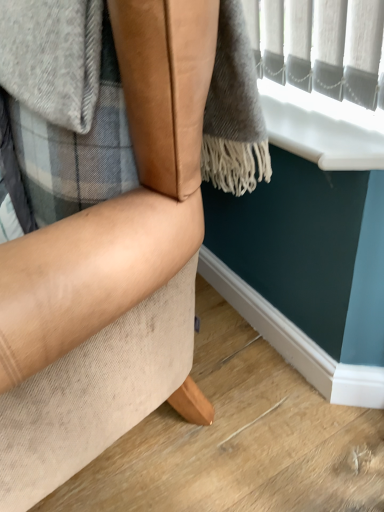
Describe the element at coordinates (95, 225) in the screenshot. I see `beige fabric ottoman at lower left` at that location.

Locate an element on the screen. This screenshot has height=512, width=384. beige fabric ottoman at lower left is located at coordinates (95, 225).

At what (x,y) coordinates should I click in order to perform the action: click on beige fabric ottoman at lower left. Please return your answer as a coordinate pair (x, y). This screenshot has height=512, width=384. Looking at the image, I should click on (95, 225).